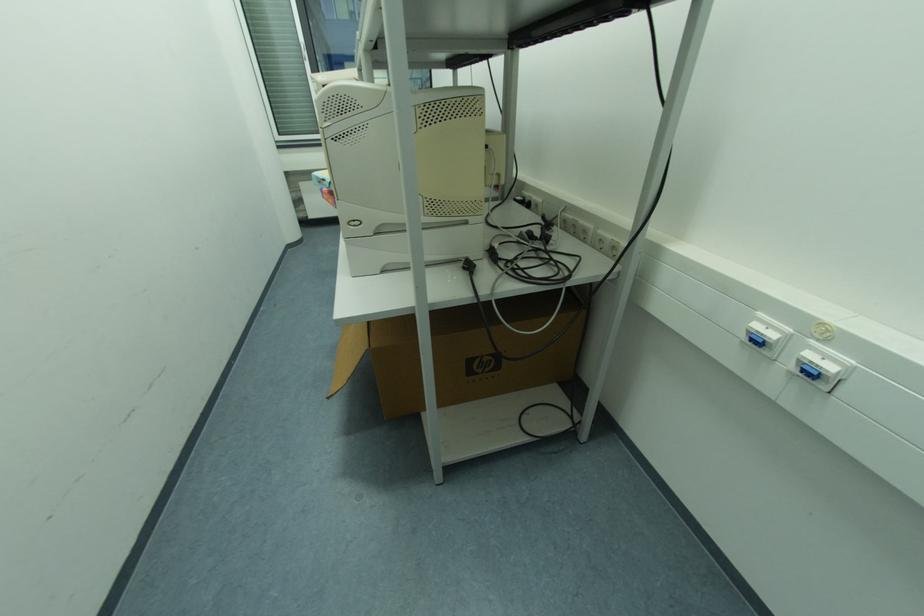
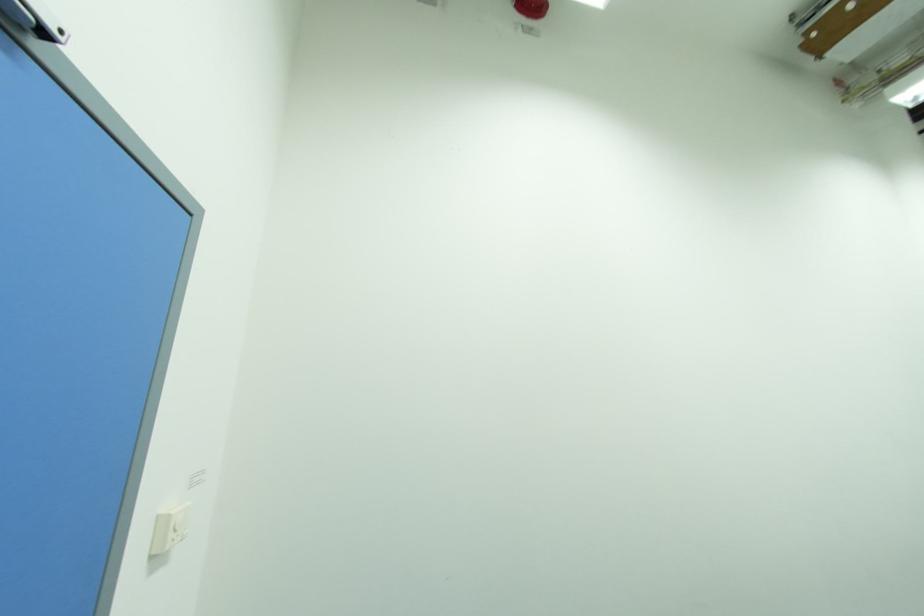
Question: The first image is from the beginning of the video and the second image is from the end. How did the camera likely rotate when shooting the video?

Choices:
 (A) Left
 (B) Right
 (C) Up
 (D) Down

Answer: (A)